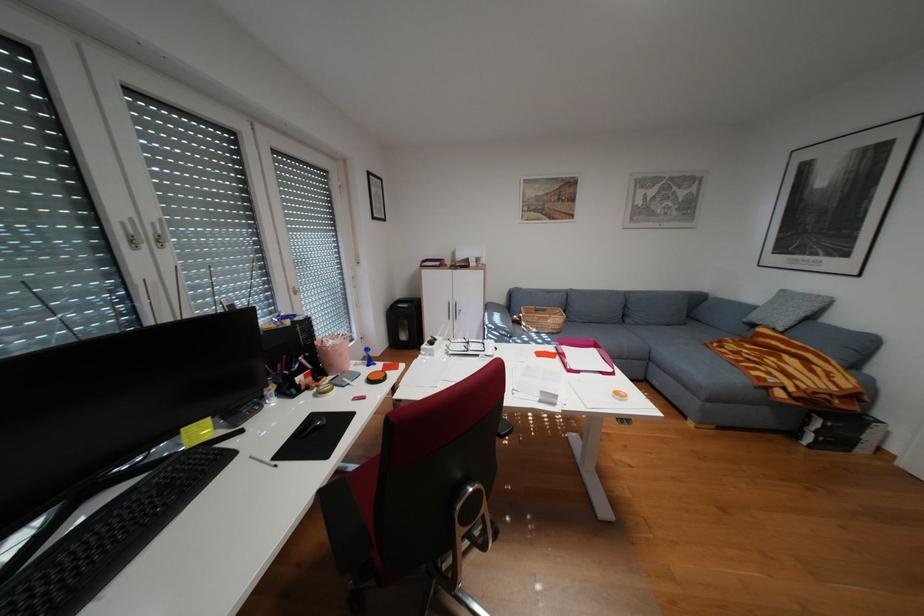
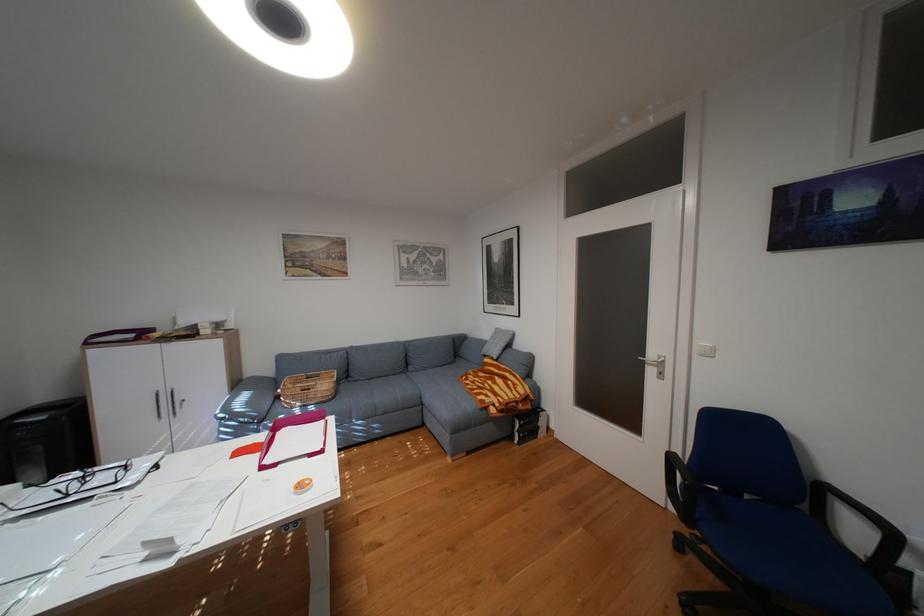
In the second image, find the point that corresponds to point 485,346 in the first image.

(114, 477)